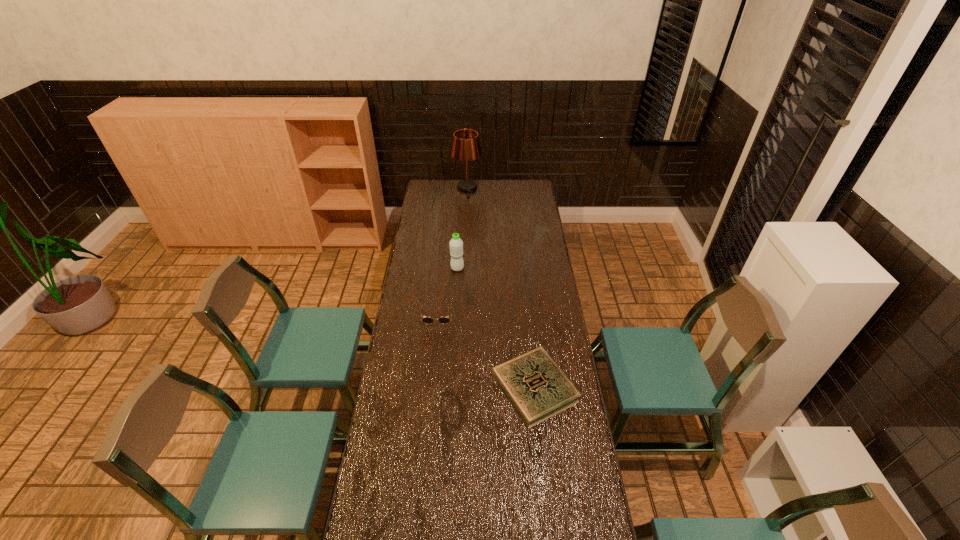
Locate an element on the screen. the tallest object is located at coordinates (466, 146).

I want to click on lampshade, so click(x=466, y=146).

The height and width of the screenshot is (540, 960). I want to click on the third nearest object, so click(456, 244).

Where is `the second tallest object`? This screenshot has height=540, width=960. the second tallest object is located at coordinates (456, 244).

You are a GUI agent. You are given a task and a screenshot of the screen. Output one action in this format:
    pyautogui.click(x=<x>, y=<y>)
    Task: Click on the second shortest object
    This screenshot has height=540, width=960.
    Given the screenshot: What is the action you would take?
    pyautogui.click(x=427, y=320)

You are a GUI agent. You are given a task and a screenshot of the screen. Output one action in this format:
    pyautogui.click(x=<x>, y=<y>)
    Task: Click on the third farthest object
    Image resolution: width=960 pixels, height=540 pixels.
    Given the screenshot: What is the action you would take?
    pyautogui.click(x=427, y=320)

Where is `hardback book`? The height and width of the screenshot is (540, 960). hardback book is located at coordinates (537, 388).

You are a GUI agent. You are given a task and a screenshot of the screen. Output one action in this format:
    pyautogui.click(x=<x>, y=<y>)
    Task: Click on the nearest object
    
    Given the screenshot: What is the action you would take?
    pyautogui.click(x=537, y=388)

This screenshot has height=540, width=960. I want to click on vacant space positioned on the front-facing side of the tallest object, so click(x=466, y=233).

This screenshot has height=540, width=960. In order to click on vacant space situated 0.150m on the front of the water bottle in this screenshot , I will do `click(456, 293)`.